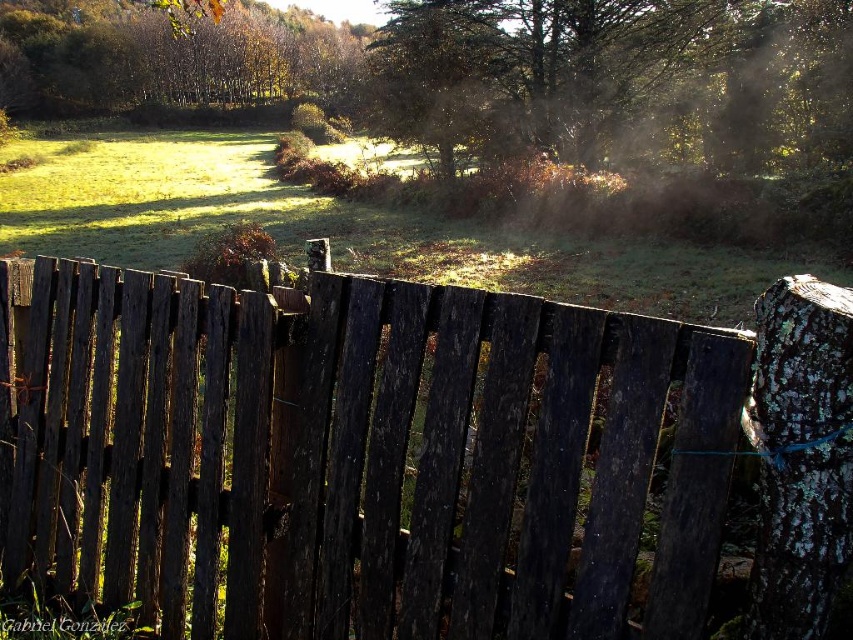
Question: Does weathered wood fence at center have a greater width compared to green leafy tree at upper left?

Choices:
 (A) no
 (B) yes

Answer: (A)

Question: Can you confirm if weathered wood fence at center is positioned to the left of green leafy tree at upper left?

Choices:
 (A) no
 (B) yes

Answer: (A)

Question: Does weathered wood fence at center appear under green leafy tree at upper left?

Choices:
 (A) yes
 (B) no

Answer: (A)